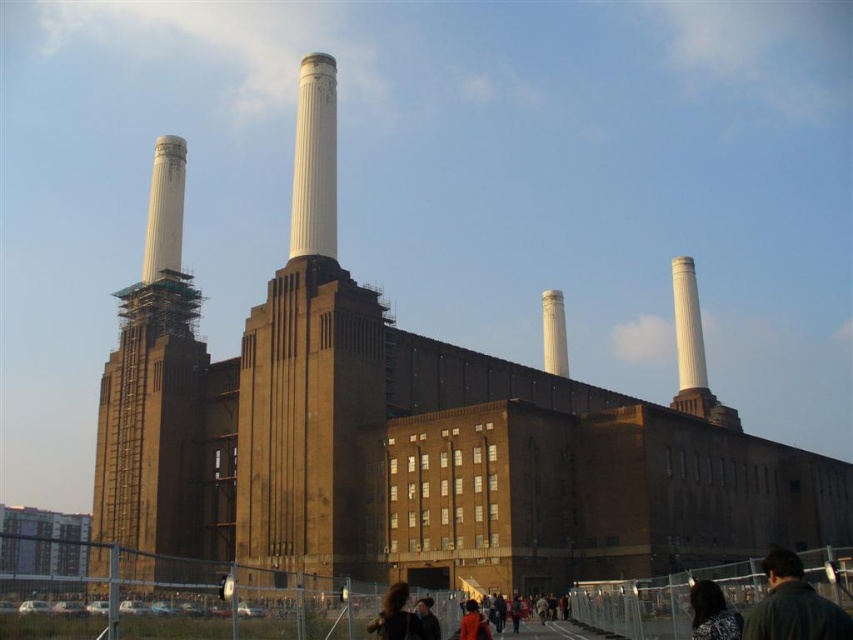
You are standing at the entrance of the industrial building and want to find the green grass at lower center. According to the coordinates provided, which direction should you look to locate it?

The green grass at lower center is located at coordinates point (166,624), which means you should look towards the lower center direction to find it.